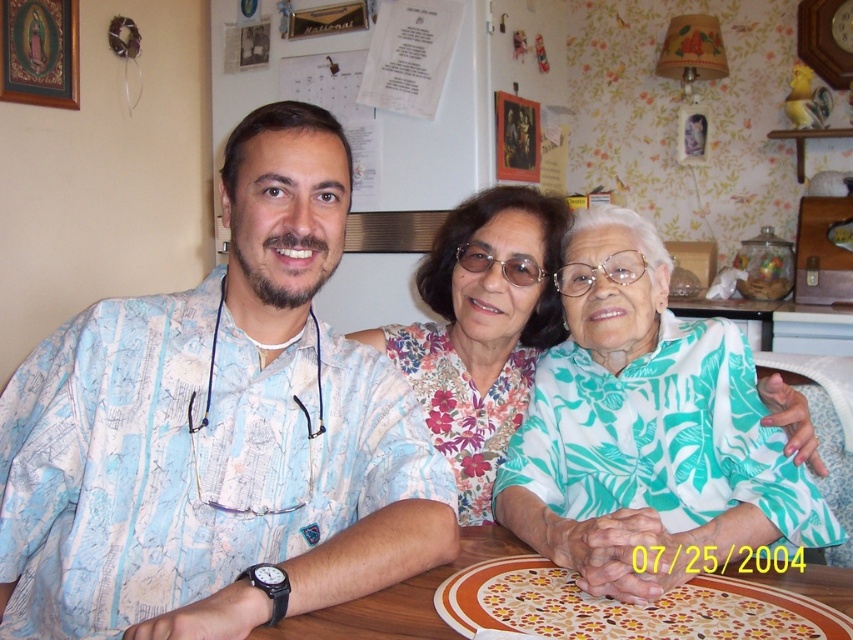
Does floral fabric blouse at center have a greater width compared to wooden table at center?

Yes.

What are the coordinates of `floral fabric blouse at center` in the screenshot? It's located at (480, 330).

Find the location of a particular element. This screenshot has height=640, width=853. floral fabric blouse at center is located at coordinates (480, 330).

Describe the element at coordinates (218, 433) in the screenshot. Image resolution: width=853 pixels, height=640 pixels. I see `blue printed shirt at center` at that location.

Does blue printed shirt at center appear on the right side of wooden table at center?

No, blue printed shirt at center is not to the right of wooden table at center.

Between point (289, 531) and point (351, 612), which one is positioned in front?

Point (351, 612) is more forward.

I want to click on blue printed shirt at center, so click(x=218, y=433).

Between blue printed shirt at center and teal floral shirt at center, which one has more height?

blue printed shirt at center is taller.

Is blue printed shirt at center below teal floral shirt at center?

Incorrect, blue printed shirt at center is not positioned below teal floral shirt at center.

This screenshot has height=640, width=853. What do you see at coordinates (218, 433) in the screenshot? I see `blue printed shirt at center` at bounding box center [218, 433].

Identify the location of blue printed shirt at center. The height and width of the screenshot is (640, 853). point(218,433).